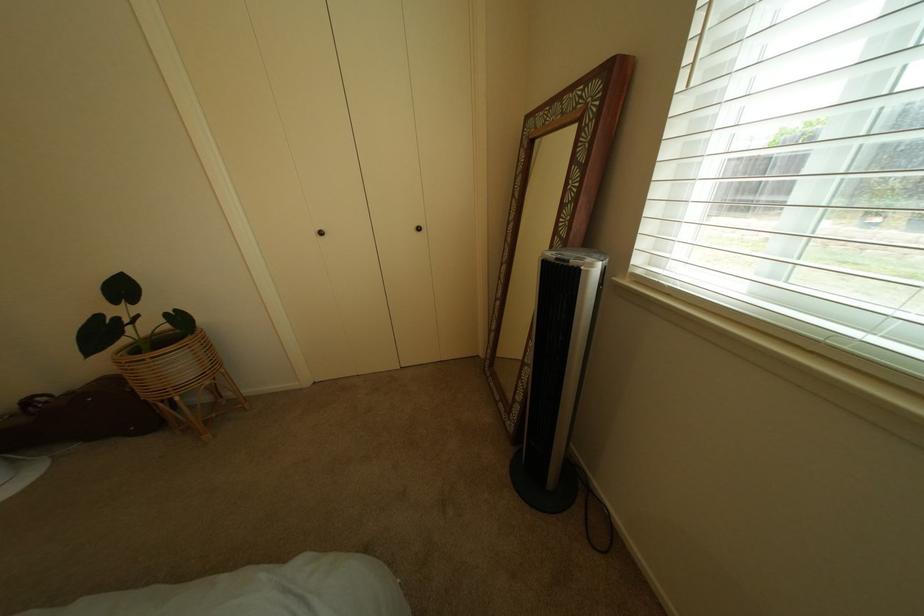
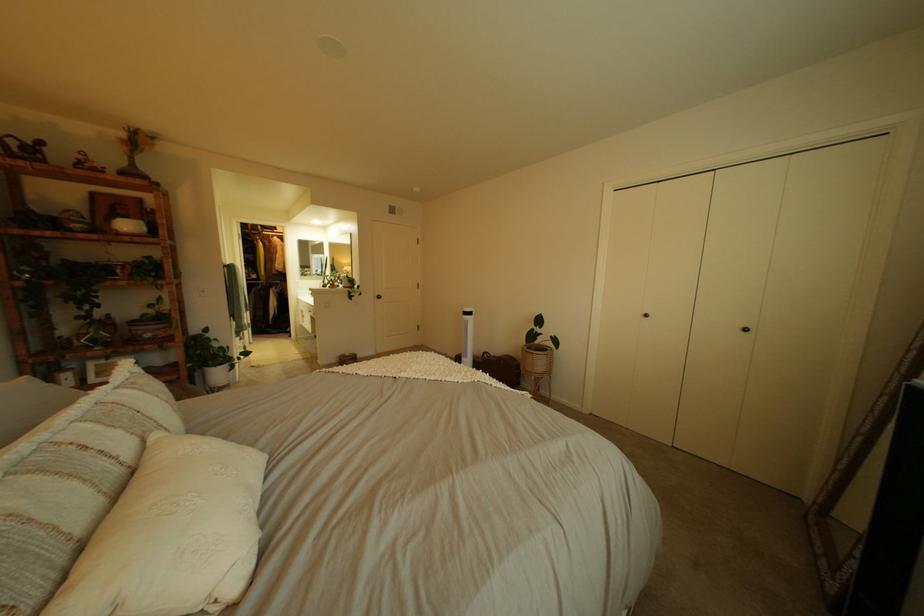
Find the pixel in the second image that matches [337,233] in the first image.

(662, 317)